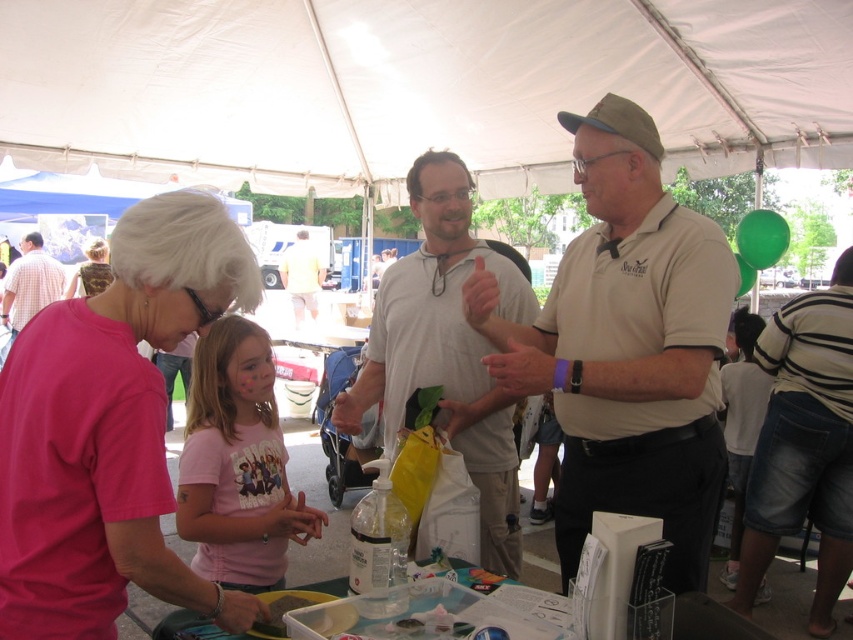
You are a photographer standing at the edge of the event area. You need to capture a group photo of the white matte shirt at center and the plaid cotton shirt at left. Given that your camera has a maximum focus range of 20 feet, will both subjects be in focus if you position yourself equidistant from both?

The distance between the white matte shirt at center and the plaid cotton shirt at left is 21.21 feet. If you position yourself equidistant from both, you would be 10.6 feet away from each. Since your camera can focus up to 20 feet, both subjects will be within the focus range and thus in focus.

You are organizing a clothing donation drive and need to categorize shirts by size. You have a white matte shirt at center and a plaid cotton shirt at left. Which shirt should you place in the small size bin?

The white matte shirt at center should be placed in the small size bin because its width is less than the plaid cotton shirt at left.